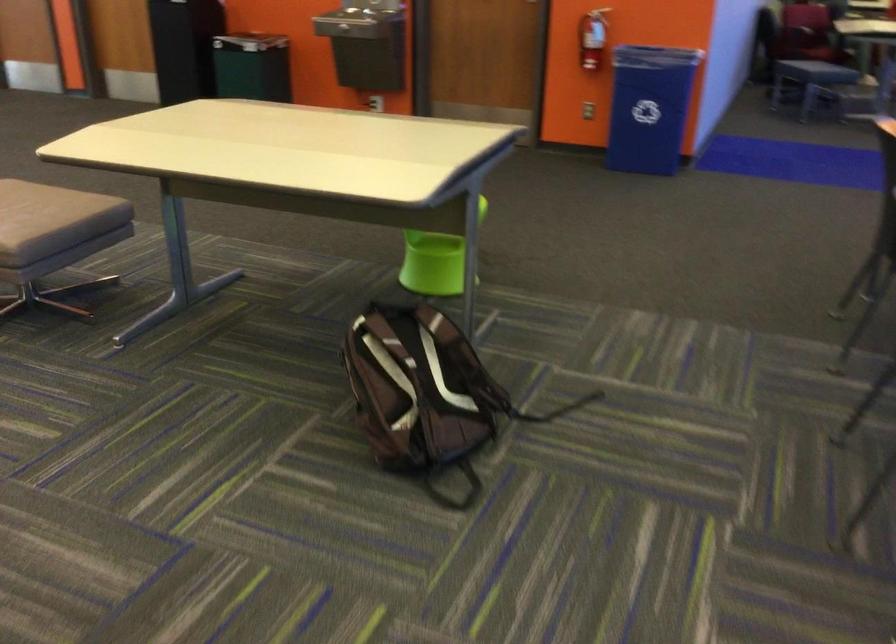
Where would you sit the chair sitting surface? Please return your answer as a coordinate pair (x, y).

(867, 22)